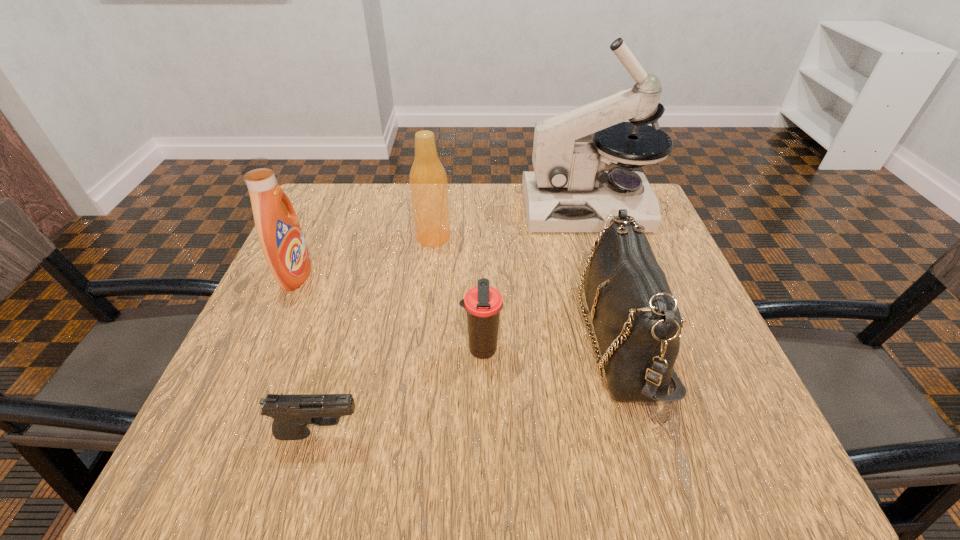
Where is `vacant point located between the shortest object and the third object from left to right`? The image size is (960, 540). vacant point located between the shortest object and the third object from left to right is located at coordinates (376, 335).

This screenshot has width=960, height=540. What are the coordinates of `vacant area between the handbag and the nearest object` in the screenshot? It's located at (470, 386).

In order to click on unoccupied position between the fourth tallest object and the leftmost object in this screenshot , I will do `click(459, 307)`.

What are the coordinates of `object that can be found as the second closest to the leftmost object` in the screenshot? It's located at (292, 413).

Find the location of `object that ranks as the closest to the detergent`. object that ranks as the closest to the detergent is located at coordinates (428, 182).

Identify the location of free location that satisfies the following two spatial constraints: 1. on the front-facing side of the leftmost object; 2. on the back side of the thermos bottle. Image resolution: width=960 pixels, height=540 pixels. (263, 350).

Find the location of `free location that satisfies the following two spatial constraints: 1. on the front-facing side of the third object from right to left; 2. on the left side of the leftmost object`. free location that satisfies the following two spatial constraints: 1. on the front-facing side of the third object from right to left; 2. on the left side of the leftmost object is located at coordinates (263, 350).

Identify the location of vacant point that satisfies the following two spatial constraints: 1. on the front-facing side of the thermos bottle; 2. on the right side of the detergent. (263, 350).